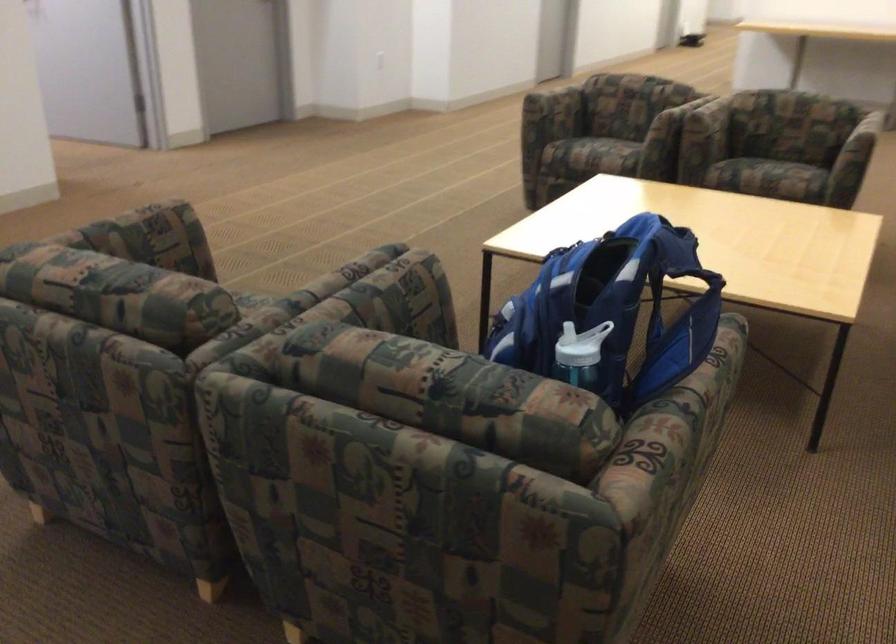
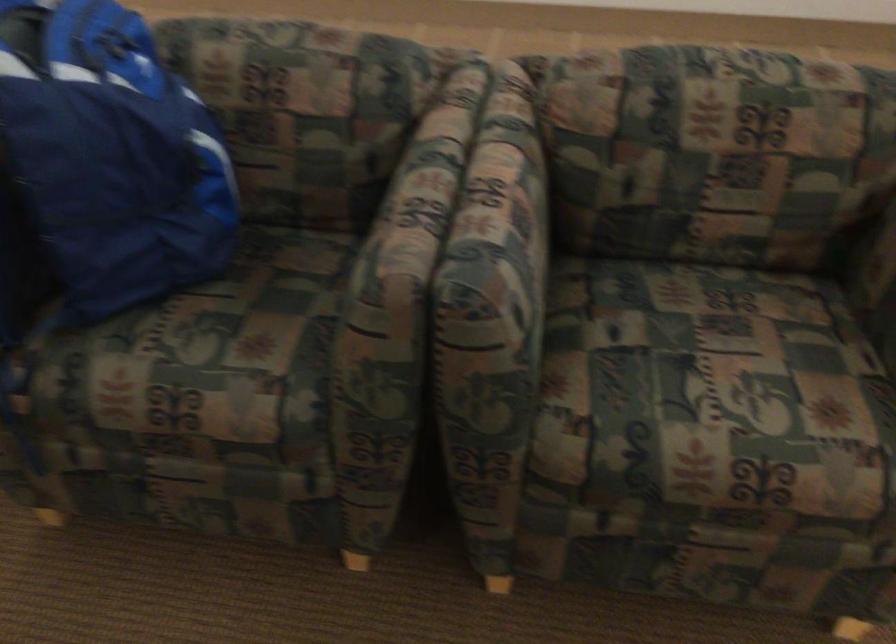
Locate, in the second image, the point that corresponds to point (558, 295) in the first image.

(112, 155)